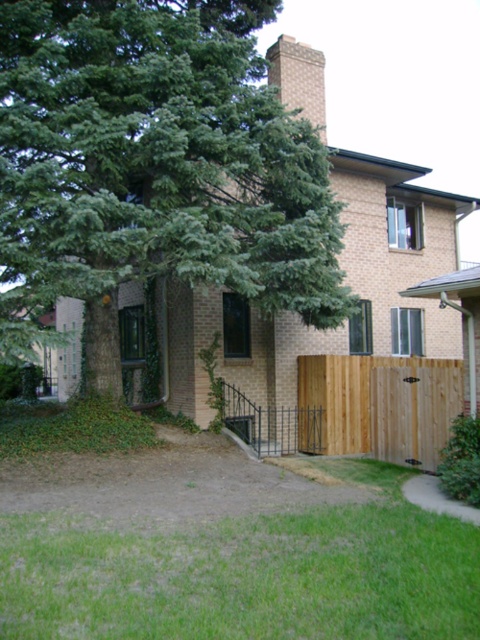
Based on the photo, you are a delivery person holding a package that requires a 5 meter clearance to safely pass between the green leafy tree at upper left and the brown wooden fence at lower right. Can you pass through this space without hitting the tree or the fence?

The distance between the green leafy tree at upper left and the brown wooden fence at lower right is 6.24 meters, which is more than the required 5 meter clearance. Therefore, you can safely pass through the space without hitting either the tree or the fence.

You are standing in front of the house and want to enter the yard through the gate. The green leafy tree at upper left and the brick chimney at upper center are in your line of sight. Which object is closer to the gate?

The green leafy tree at upper left is positioned on the left side of brick chimney at upper center. Since the gate is part of the fence near the front of the house, the green leafy tree at upper left would be closer to the gate than the brick chimney at upper center.